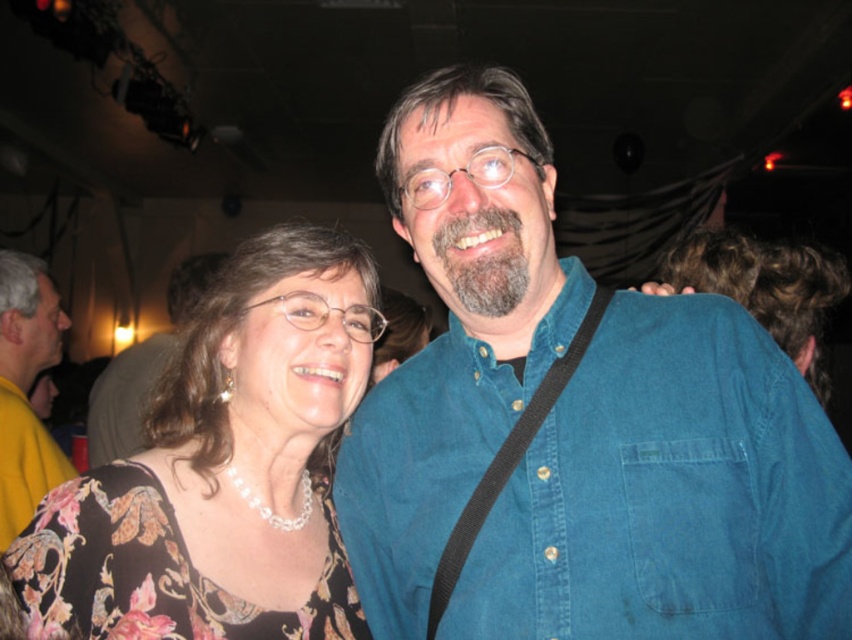
Who is more distant from viewer, (105, 627) or (15, 314)?

The point (15, 314) is behind.

Is point (235, 260) in front of point (26, 429)?

Yes.

The width and height of the screenshot is (852, 640). What are the coordinates of `floral-patterned blouse at left` in the screenshot? It's located at (223, 467).

Does blue denim shirt at center have a lesser height compared to matte black shirt at center?

No.

From the picture: Is blue denim shirt at center bigger than matte black shirt at center?

No, blue denim shirt at center is not bigger than matte black shirt at center.

I want to click on blue denim shirt at center, so click(x=669, y=493).

Find the location of a particular element. blue denim shirt at center is located at coordinates (669, 493).

Between point (786, 445) and point (98, 477), which one is positioned behind?

Positioned behind is point (98, 477).

Who is more forward, (423, 456) or (325, 260)?

Point (423, 456) is more forward.

This screenshot has height=640, width=852. What do you see at coordinates (669, 493) in the screenshot?
I see `blue denim shirt at center` at bounding box center [669, 493].

You are a GUI agent. You are given a task and a screenshot of the screen. Output one action in this format:
    pyautogui.click(x=<x>, y=<y>)
    Task: Click on the blue denim shirt at center
    
    Given the screenshot: What is the action you would take?
    pyautogui.click(x=669, y=493)